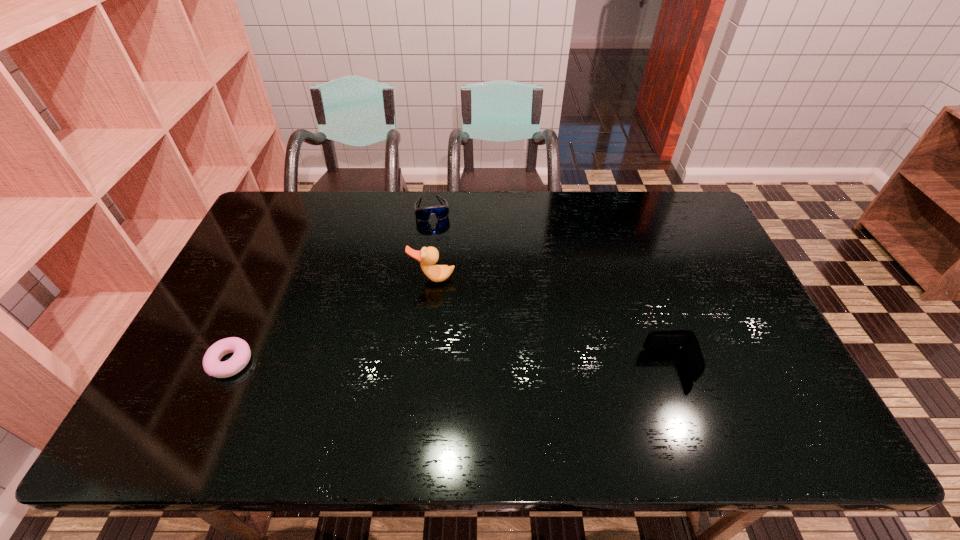
Locate an element on the screen. Image resolution: width=960 pixels, height=540 pixels. pastry is located at coordinates (212, 366).

Locate an element on the screen. The height and width of the screenshot is (540, 960). the leftmost object is located at coordinates (212, 366).

You are a GUI agent. You are given a task and a screenshot of the screen. Output one action in this format:
    pyautogui.click(x=<x>, y=<y>)
    Task: Click on the rightmost object
    This screenshot has height=540, width=960.
    Given the screenshot: What is the action you would take?
    pyautogui.click(x=685, y=340)

Identify the location of the third shortest object. click(685, 340).

This screenshot has width=960, height=540. In order to click on the tallest object in this screenshot , I will do `click(428, 256)`.

Find the location of a particular element. The height and width of the screenshot is (540, 960). the third nearest object is located at coordinates (428, 256).

The width and height of the screenshot is (960, 540). I want to click on the third tallest object, so tap(441, 212).

The image size is (960, 540). What are the coordinates of `the farthest object` in the screenshot? It's located at (441, 212).

Find the location of a particular element. free space located 0.340m on the back of the shortest object is located at coordinates (279, 255).

You are a GUI agent. You are given a task and a screenshot of the screen. Output one action in this format:
    pyautogui.click(x=<x>, y=<y>)
    Task: Click on the vacant space located on the outer surface of the second tallest object
    
    Given the screenshot: What is the action you would take?
    pyautogui.click(x=515, y=366)